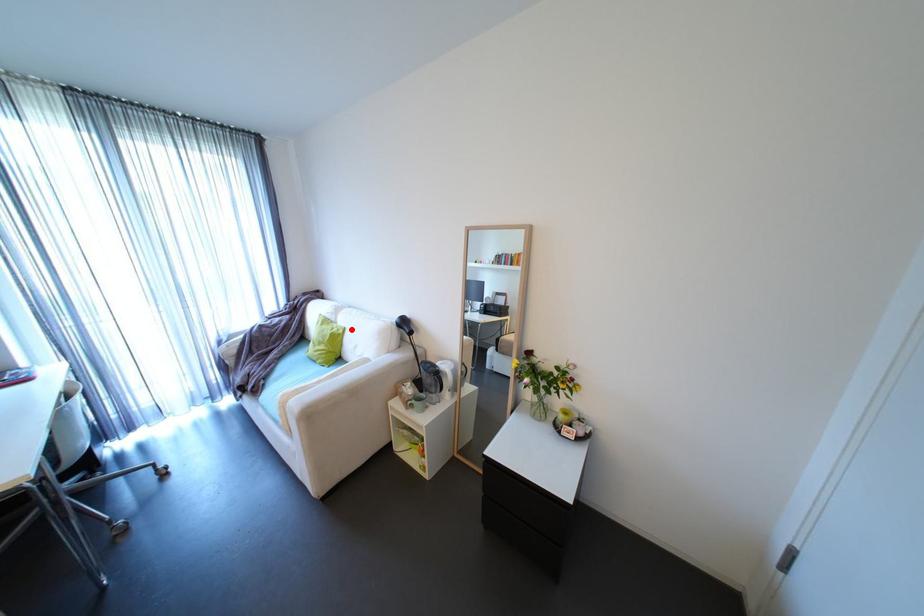
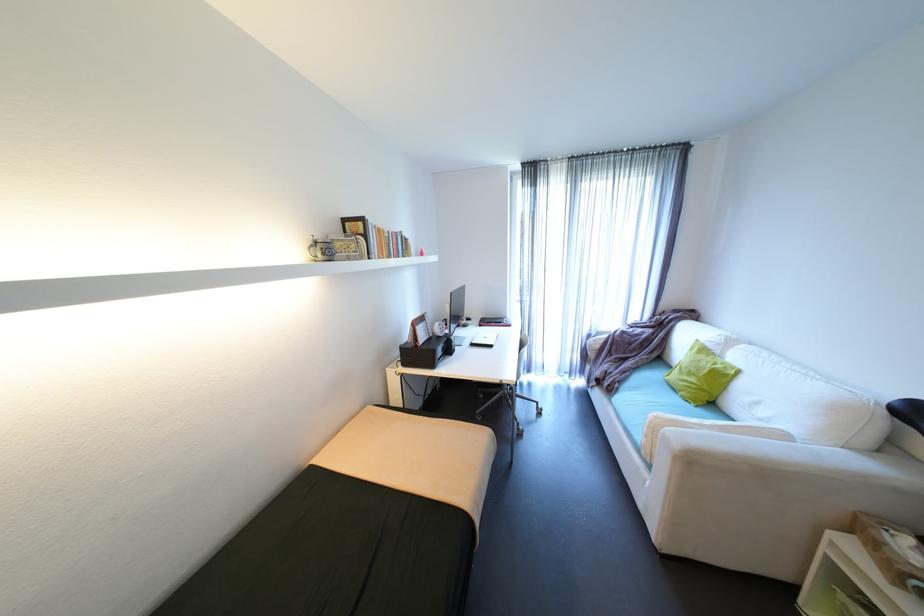
The point at the highlighted location is marked in the first image. Where is the corresponding point in the second image?

(747, 371)